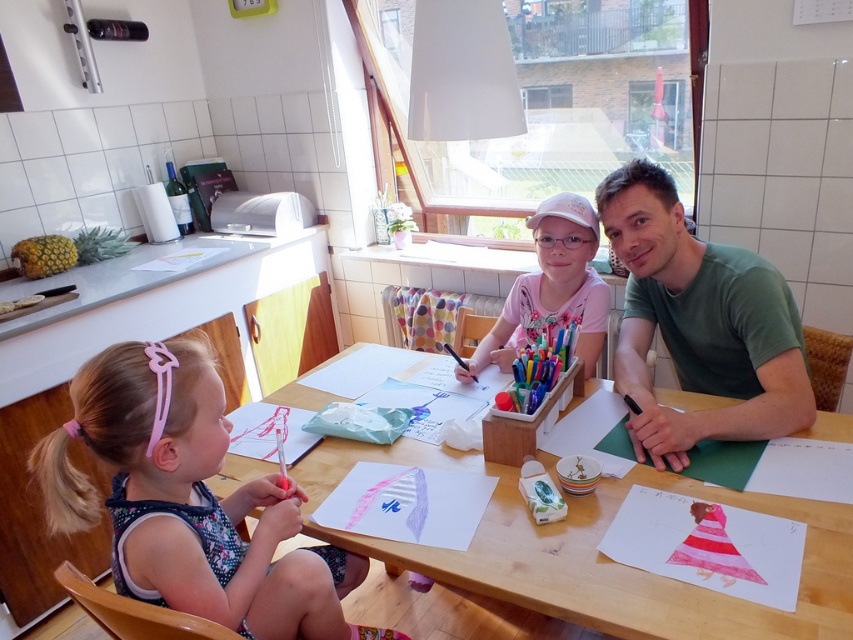
Which is in front, point (514, 589) or point (781, 368)?

Point (514, 589) is more forward.

In order to click on wooden table at center in this screenshot , I will do `click(595, 554)`.

Between floral dress at lower left and green cotton shirt at upper right, which one has less height?

floral dress at lower left is shorter.

Is point (172, 368) farther from camera compared to point (780, 339)?

That is False.

Measure the distance between floral dress at lower left and camera.

floral dress at lower left and camera are 38.89 inches apart from each other.

At what (x,y) coordinates should I click in order to perform the action: click on floral dress at lower left. Please return your answer as a coordinate pair (x, y). Looking at the image, I should click on (189, 500).

Between floral dress at lower left and pink fabric shirt at center, which one is positioned lower?

floral dress at lower left is below.

Between floral dress at lower left and pink fabric shirt at center, which one is positioned higher?

Positioned higher is pink fabric shirt at center.

Image resolution: width=853 pixels, height=640 pixels. Describe the element at coordinates (189, 500) in the screenshot. I see `floral dress at lower left` at that location.

I want to click on floral dress at lower left, so click(x=189, y=500).